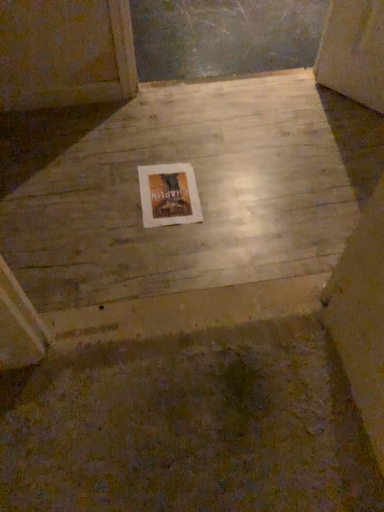
Question: From their relative heights in the image, would you say smooth concrete floor at center is taller or shorter than white paper at center?

Choices:
 (A) short
 (B) tall

Answer: (B)

Question: Is point (135, 285) closer or farther from the camera than point (180, 196)?

Choices:
 (A) closer
 (B) farther

Answer: (A)

Question: Is smooth concrete floor at center bigger or smaller than white paper at center?

Choices:
 (A) small
 (B) big

Answer: (B)

Question: Considering the positions of white paper at center and smooth concrete floor at center in the image, is white paper at center wider or thinner than smooth concrete floor at center?

Choices:
 (A) thin
 (B) wide

Answer: (A)

Question: Based on their sizes in the image, would you say white paper at center is bigger or smaller than smooth concrete floor at center?

Choices:
 (A) big
 (B) small

Answer: (B)

Question: From a real-world perspective, is white paper at center physically located above or below smooth concrete floor at center?

Choices:
 (A) below
 (B) above

Answer: (B)

Question: In the image, is white paper at center positioned in front of or behind smooth concrete floor at center?

Choices:
 (A) front
 (B) behind

Answer: (B)